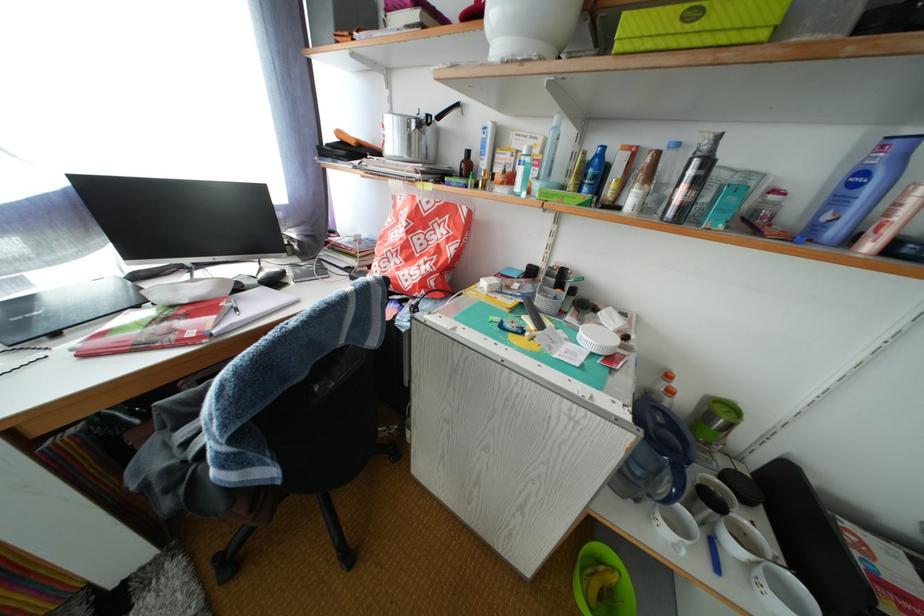
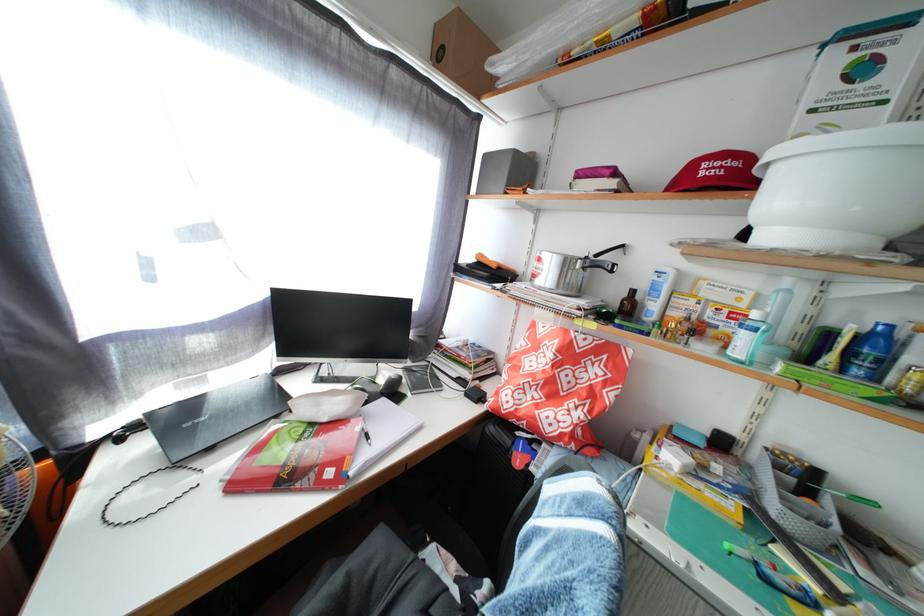
In the second image, find the point that corresponds to (x=593, y=196) in the first image.

(866, 378)